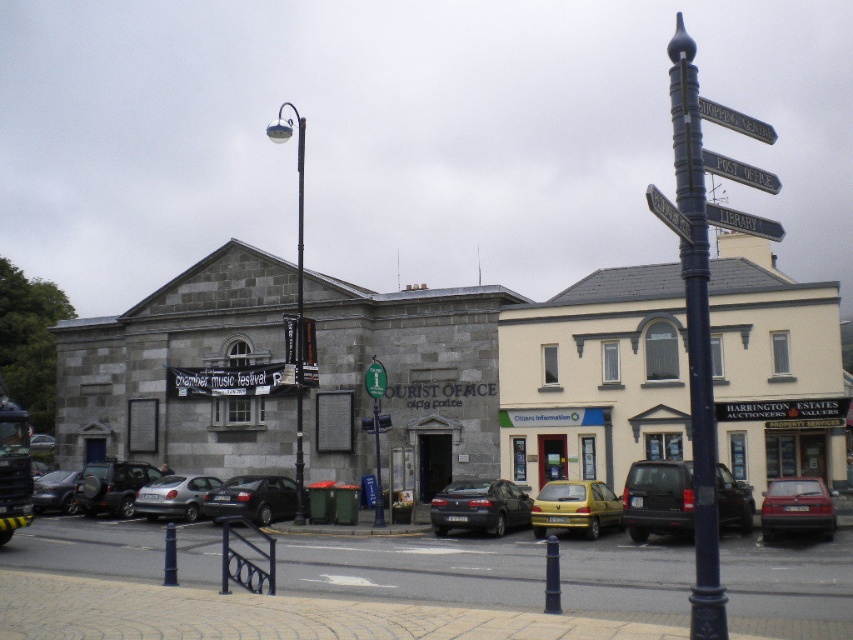
Question: Which point is closer to the camera?

Choices:
 (A) black metal pole at upper right
 (B) matte red car at center

Answer: (A)

Question: Estimate the real-world distances between objects in this image. Which object is farther from the black metal pole at upper right?

Choices:
 (A) metallic post office sign at upper right
 (B) shiny black sedan at center
 (C) matte black lamp post at center

Answer: (C)

Question: Is dark gray matte suv at center wider than metallic post office sign at upper right?

Choices:
 (A) no
 (B) yes

Answer: (A)

Question: Which object is the closest to the matte black lamp post at center?

Choices:
 (A) metallic silver suv at center-left
 (B) metallic signpost at upper center

Answer: (B)

Question: Where is dark gray matte suv at center located in relation to black metal signpost at upper center in the image?

Choices:
 (A) right
 (B) left

Answer: (B)

Question: Is shiny black sedan at center closer to camera compared to matte black car at left?

Choices:
 (A) no
 (B) yes

Answer: (B)